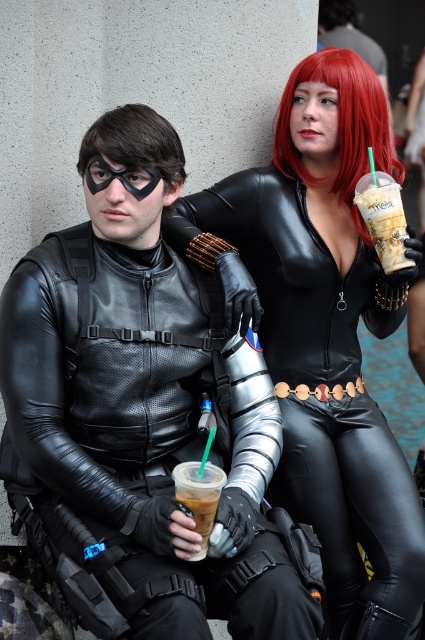
Is matte black suit at center bigger than red matte wig at upper right?

Yes.

Between point (20, 317) and point (334, 54), which one is positioned behind?

The point (334, 54) is more distant.

The height and width of the screenshot is (640, 425). What are the coordinates of `matte black suit at center` in the screenshot? It's located at (139, 417).

Does shiny black bodysuit at upper right have a greater width compared to iced coffee at lower center?

Correct, the width of shiny black bodysuit at upper right exceeds that of iced coffee at lower center.

Is shiny black bodysuit at upper right behind iced coffee at lower center?

Yes, it is.

Does point (401, 321) come closer to viewer compared to point (187, 486)?

No, it is not.

In order to click on shiny black bodysuit at upper right in this screenshot , I will do `click(323, 332)`.

Does matte black suit at center have a lesser width compared to iced coffee at lower center?

No, matte black suit at center is not thinner than iced coffee at lower center.

Can you confirm if matte black suit at center is positioned below iced coffee at lower center?

No.

At what (x,y) coordinates should I click in order to perform the action: click on matte black suit at center. Please return your answer as a coordinate pair (x, y). Looking at the image, I should click on (139, 417).